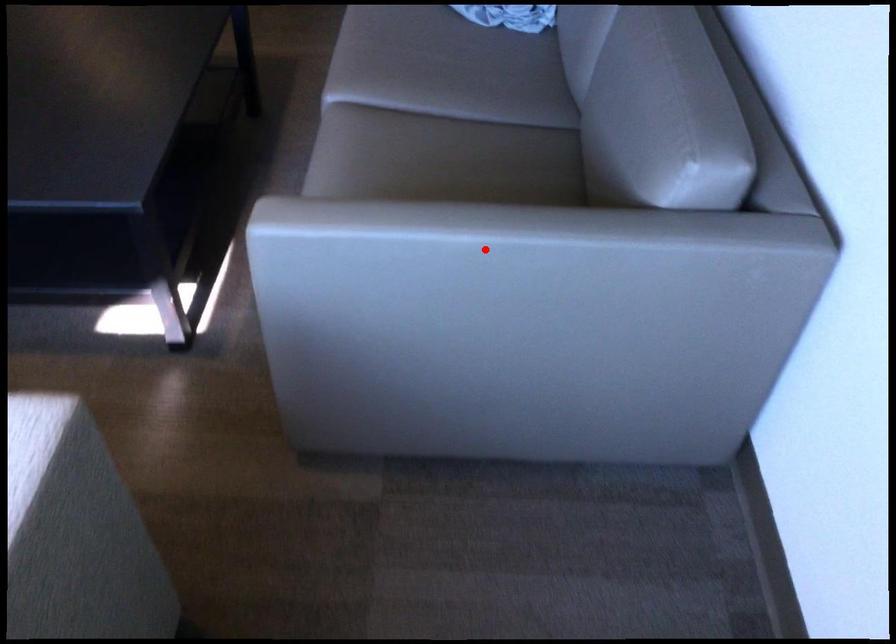
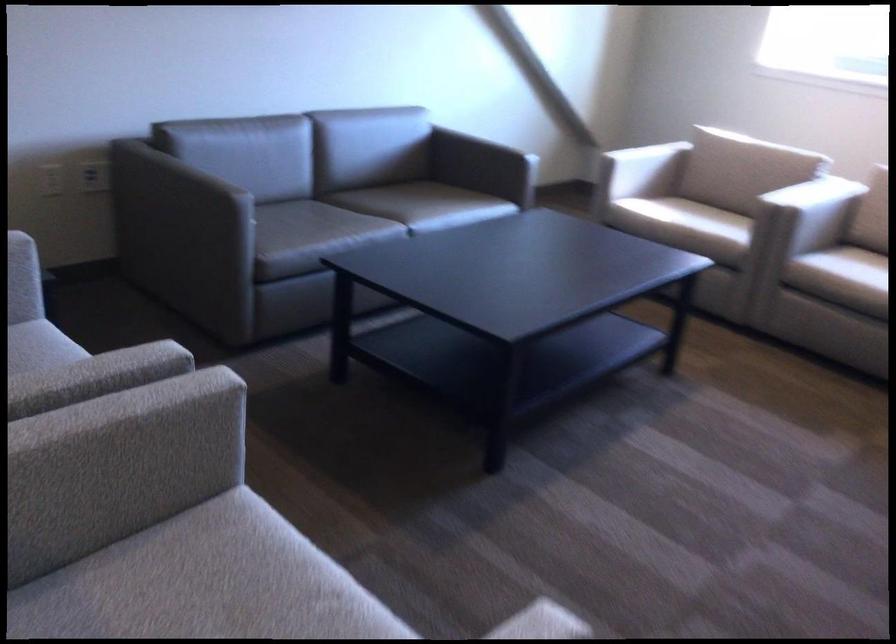
Question: I am providing you with two images of the same scene from different viewpoints. A red point is marked on the first image. Is the red point's position out of view in image 2?

Choices:
 (A) Yes
 (B) No

Answer: (A)